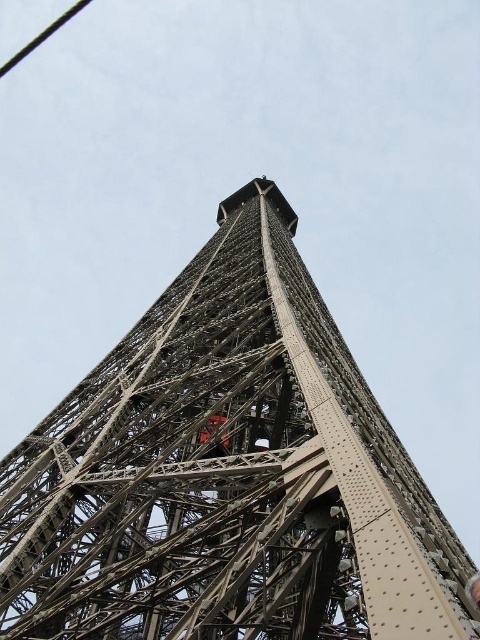
Does metallic steel tower at center appear over black wire at upper left?

No.

Is point (208, 637) positioned before point (4, 67)?

Yes, point (208, 637) is closer to viewer.

Locate an element on the screen. Image resolution: width=480 pixels, height=640 pixels. metallic steel tower at center is located at coordinates (227, 474).